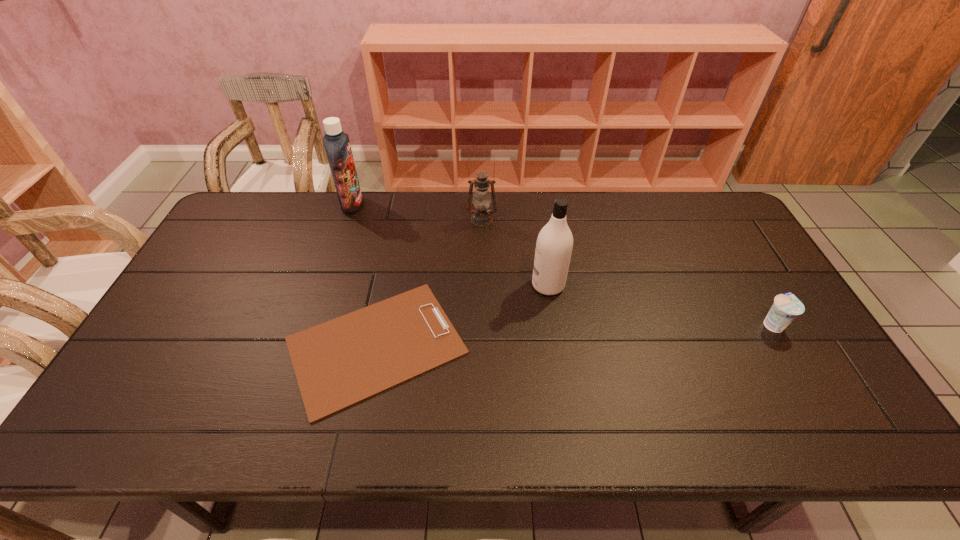
Where is `the left shampoo`? The width and height of the screenshot is (960, 540). the left shampoo is located at coordinates (336, 143).

At what (x,y) coordinates should I click in order to perform the action: click on the right shampoo. Please return your answer as a coordinate pair (x, y). Looking at the image, I should click on (554, 244).

This screenshot has height=540, width=960. What are the coordinates of `the second object from right to left` in the screenshot? It's located at (554, 244).

Locate an element on the screen. The height and width of the screenshot is (540, 960). oil lamp is located at coordinates (481, 216).

Locate an element on the screen. yogurt is located at coordinates (786, 307).

Locate an element on the screen. The width and height of the screenshot is (960, 540). the rightmost object is located at coordinates pos(786,307).

What are the coordinates of `the shortest object` in the screenshot? It's located at (341, 362).

This screenshot has height=540, width=960. I want to click on free space located 0.060m on the front label of the farther shampoo, so click(x=380, y=205).

Locate an element on the screen. This screenshot has height=540, width=960. free spot located 0.290m on the front-facing side of the nearer shampoo is located at coordinates (433, 285).

This screenshot has width=960, height=540. In order to click on blank space located 0.220m on the front-facing side of the nearer shampoo in this screenshot , I will do `click(457, 285)`.